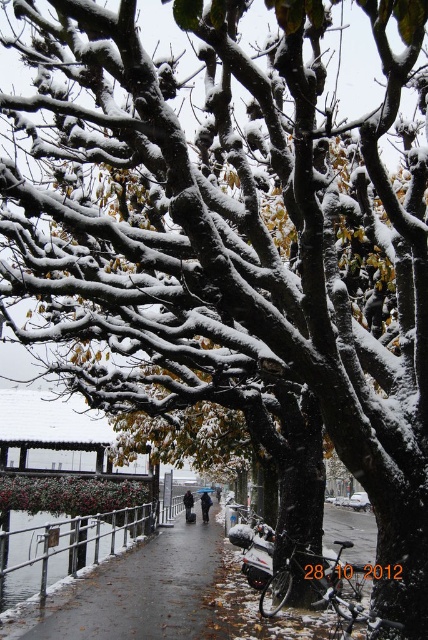
Who is taller, concrete sidewalk at center or dark blue jacket at center?

concrete sidewalk at center

Consider the image. Which is more to the right, concrete sidewalk at center or dark blue jacket at center?

Positioned to the right is dark blue jacket at center.

Which is behind, point (186, 596) or point (202, 513)?

The point (202, 513) is more distant.

Where is `concrete sidewalk at center`? concrete sidewalk at center is located at coordinates (134, 593).

Is dark blue jacket at center taller than dark gray jacket at center?

Incorrect, dark blue jacket at center's height is not larger of dark gray jacket at center's.

Can you confirm if dark blue jacket at center is positioned above dark gray jacket at center?

Incorrect, dark blue jacket at center is not positioned above dark gray jacket at center.

Identify the location of dark blue jacket at center. The image size is (428, 640). (205, 506).

Can you confirm if concrete sidewalk at center is wider than dark gray jacket at center?

Indeed, concrete sidewalk at center has a greater width compared to dark gray jacket at center.

Who is lower down, concrete sidewalk at center or dark gray jacket at center?

dark gray jacket at center

This screenshot has width=428, height=640. Find the location of `concrete sidewalk at center`. concrete sidewalk at center is located at coordinates (134, 593).

Find the location of a particular element. concrete sidewalk at center is located at coordinates (134, 593).